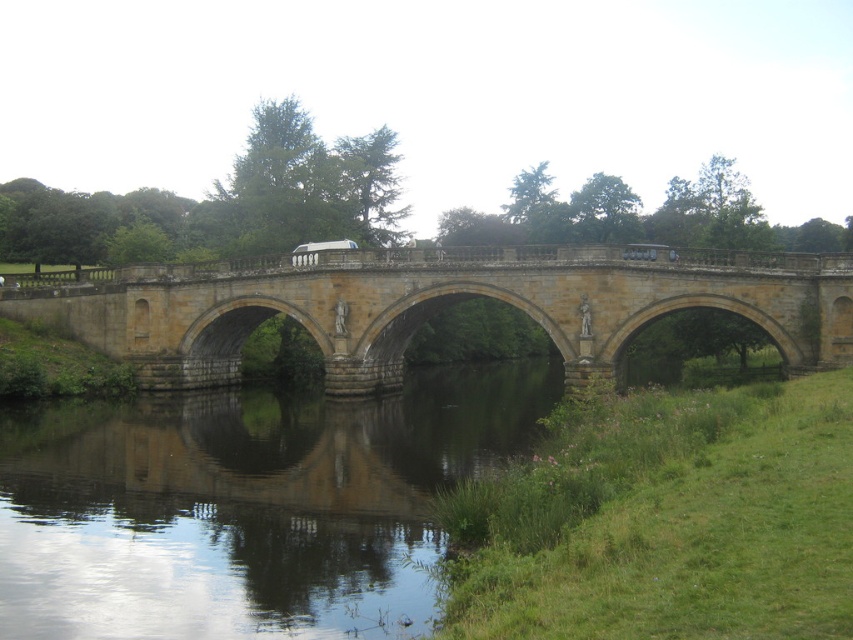
Question: Can you confirm if smooth reflective water at center is smaller than stone bridge at center?

Choices:
 (A) no
 (B) yes

Answer: (B)

Question: Does smooth reflective water at center come behind stone bridge at center?

Choices:
 (A) yes
 (B) no

Answer: (B)

Question: Which point appears closest to the camera in this image?

Choices:
 (A) (619, 346)
 (B) (103, 548)

Answer: (B)

Question: Where is smooth reflective water at center located in relation to stone bridge at center in the image?

Choices:
 (A) left
 (B) right

Answer: (A)